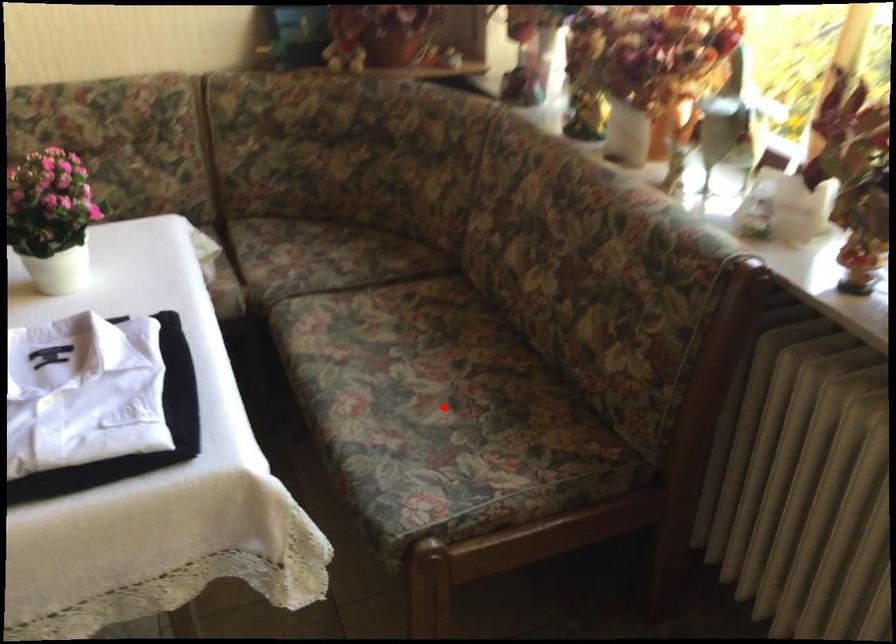
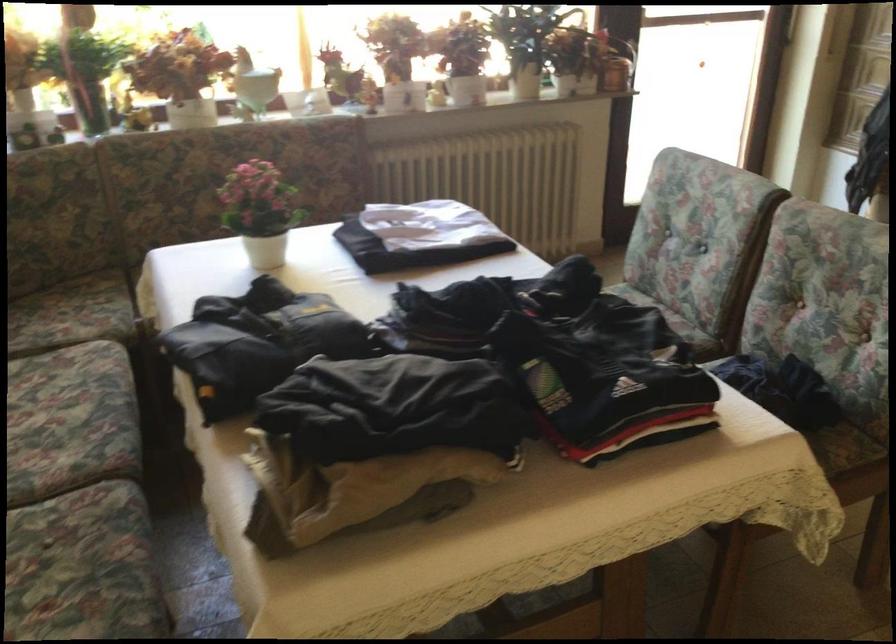
Question: I am providing you with two images of the same scene from different viewpoints. A red point is marked on the first image. Can you still see the location of the red point in image 2?

Choices:
 (A) Yes
 (B) No

Answer: (B)